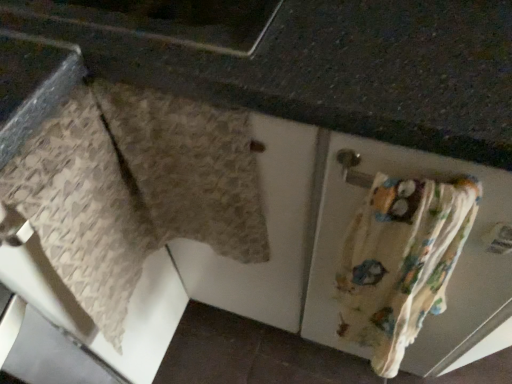
Identify the location of floral cotton towel at right. The height and width of the screenshot is (384, 512). (401, 261).

What do you see at coordinates (401, 261) in the screenshot? I see `floral cotton towel at right` at bounding box center [401, 261].

This screenshot has height=384, width=512. I want to click on floral cotton towel at right, so click(401, 261).